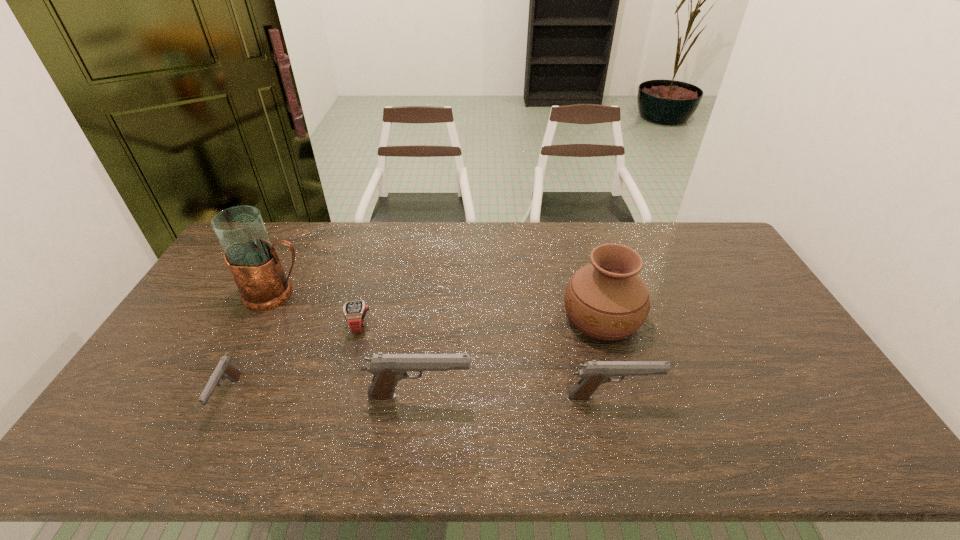
Locate an element on the screen. The height and width of the screenshot is (540, 960). the shortest pistol is located at coordinates (224, 369).

The height and width of the screenshot is (540, 960). In order to click on the fourth object from left to right in this screenshot , I will do `click(388, 369)`.

At what (x,y) coordinates should I click in order to perform the action: click on the third shortest object. Please return your answer as a coordinate pair (x, y). This screenshot has height=540, width=960. Looking at the image, I should click on (594, 373).

Find the location of a particular element. This screenshot has height=540, width=960. the second shortest pistol is located at coordinates (594, 373).

Find the location of a particular element. the third object from left to right is located at coordinates (354, 311).

At what (x,y) coordinates should I click in order to perform the action: click on watch. Please return your answer as a coordinate pair (x, y). Looking at the image, I should click on (x=354, y=311).

Where is `pitcher`? Image resolution: width=960 pixels, height=540 pixels. pitcher is located at coordinates (252, 259).

Where is `urn`? This screenshot has width=960, height=540. urn is located at coordinates (607, 300).

Image resolution: width=960 pixels, height=540 pixels. I want to click on vacant space located at the barrel of the third object from right to left, so click(505, 396).

Locate an element on the screen. This screenshot has height=540, width=960. vacant space located at the barrel of the second tallest pistol is located at coordinates (776, 397).